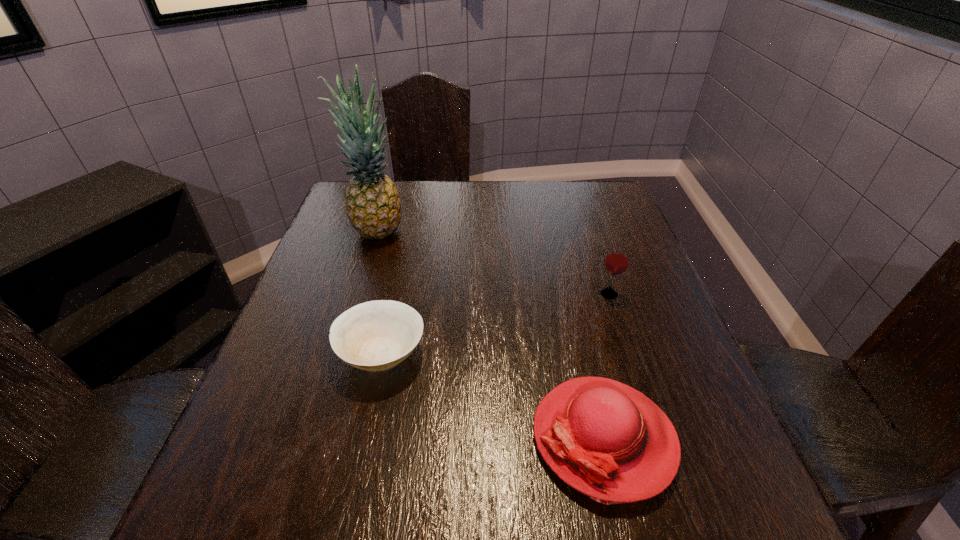
Find the location of a particular element. This screenshot has height=540, width=960. vacant area at the far edge of the desktop is located at coordinates (548, 197).

Locate an element on the screen. vacant space at the left edge is located at coordinates (294, 388).

In the image, there is a desktop. In order to click on free space at the right edge in this screenshot , I will do `click(692, 403)`.

Where is `vacant area at the far right corner of the desktop`? This screenshot has height=540, width=960. vacant area at the far right corner of the desktop is located at coordinates (605, 211).

Where is `unoccupied area between the third tallest object and the farthest object`? The width and height of the screenshot is (960, 540). unoccupied area between the third tallest object and the farthest object is located at coordinates (490, 334).

Locate an element on the screen. The width and height of the screenshot is (960, 540). vacant point located between the second shortest object and the tallest object is located at coordinates (490, 334).

Where is `vacant space that is in between the bowl and the third tallest object`? vacant space that is in between the bowl and the third tallest object is located at coordinates (492, 395).

This screenshot has width=960, height=540. What are the coordinates of `vacant space in between the second farthest object and the tallest object` in the screenshot? It's located at (492, 262).

This screenshot has width=960, height=540. In order to click on free space between the second shortest object and the second tallest object in this screenshot , I will do `click(607, 366)`.

This screenshot has width=960, height=540. In order to click on vacant point located between the farthest object and the third tallest object in this screenshot , I will do `click(490, 334)`.